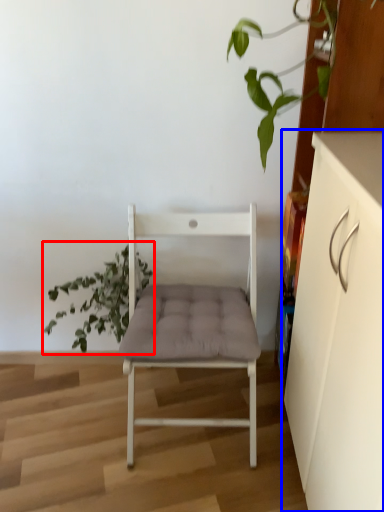
Question: Which object appears farthest to the camera in this image, houseplant (highlighted by a red box) or cabinetry (highlighted by a blue box)?

Choices:
 (A) houseplant
 (B) cabinetry

Answer: (A)